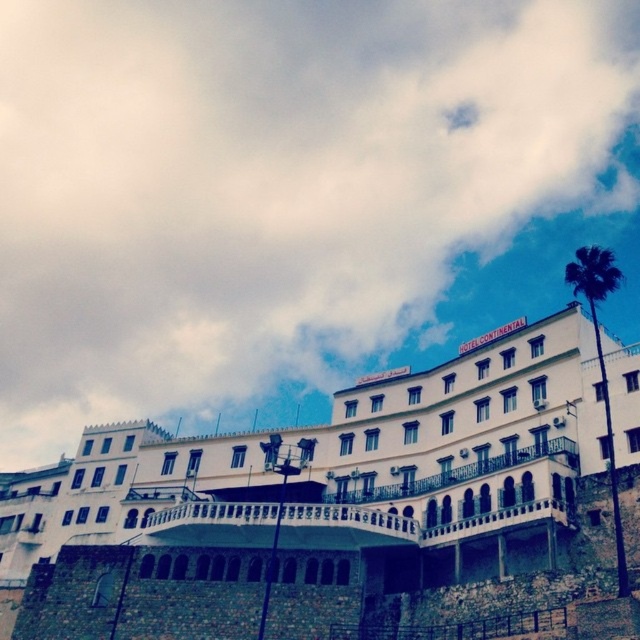
Question: Considering the relative positions of white stone building at center and green leafy palm at upper right in the image provided, where is white stone building at center located with respect to green leafy palm at upper right?

Choices:
 (A) above
 (B) below

Answer: (B)

Question: Which point is farther from the camera taking this photo?

Choices:
 (A) (x=122, y=624)
 (B) (x=586, y=288)

Answer: (A)

Question: Is white stone building at center positioned in front of green leafy palm at upper right?

Choices:
 (A) no
 (B) yes

Answer: (B)

Question: Does white stone building at center have a larger size compared to green leafy palm at upper right?

Choices:
 (A) no
 (B) yes

Answer: (A)

Question: Among these points, which one is nearest to the camera?

Choices:
 (A) (557, 588)
 (B) (595, 268)

Answer: (A)